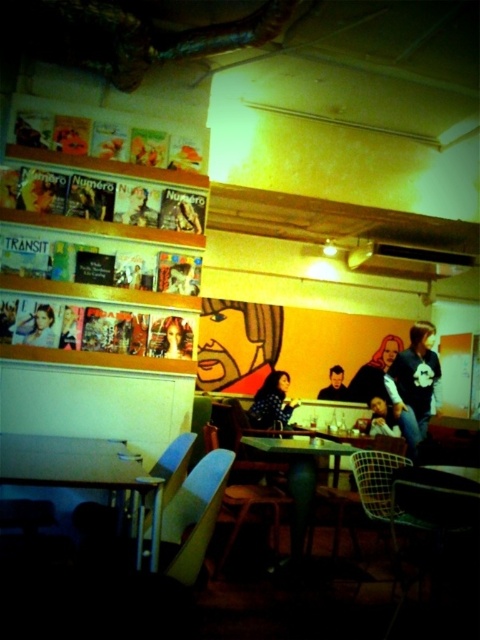
From the picture: Who is lower down, wooden table at center or polka dot blouse at center?

wooden table at center is lower down.

Can you confirm if wooden table at center is bigger than polka dot blouse at center?

Yes, wooden table at center is bigger than polka dot blouse at center.

Who is more forward, (x=291, y=518) or (x=272, y=390)?

Positioned in front is point (x=291, y=518).

This screenshot has width=480, height=640. Identify the location of wooden table at center. (300, 474).

Is wooden table at center wider than matte black portrait at lower left?

Correct, the width of wooden table at center exceeds that of matte black portrait at lower left.

Between wooden table at center and matte black portrait at lower left, which one has more height?

Standing taller between the two is wooden table at center.

Measure the distance between wooden table at center and camera.

10.32 feet

This screenshot has width=480, height=640. In order to click on wooden table at center in this screenshot , I will do `click(300, 474)`.

Is point (136, 538) closer to camera compared to point (39, 337)?

Yes, it is.

Between metallic silver table at lower left and matte black portrait at lower left, which one has more height?

metallic silver table at lower left

Locate an element on the screen. The height and width of the screenshot is (640, 480). metallic silver table at lower left is located at coordinates (82, 472).